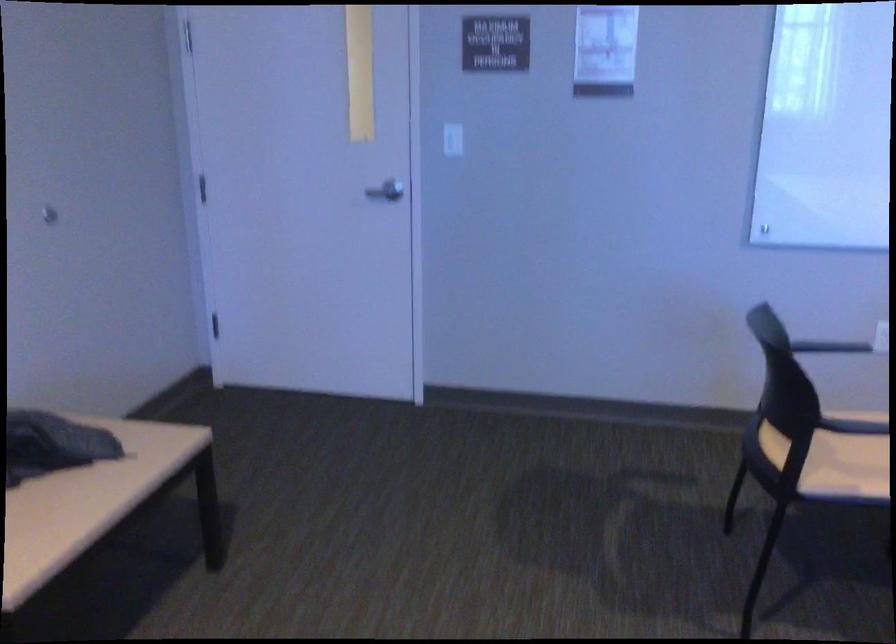
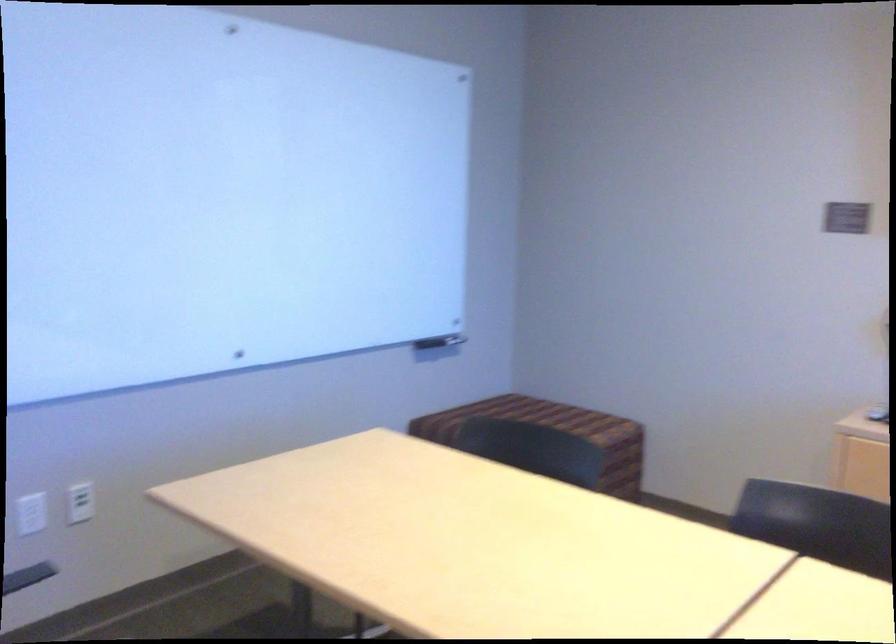
Question: The camera is either moving clockwise (left) or counter-clockwise (right) around the object. The first image is from the beginning of the video and the second image is from the end. Is the camera moving left or right when shooting the video?

Choices:
 (A) Left
 (B) Right

Answer: (A)